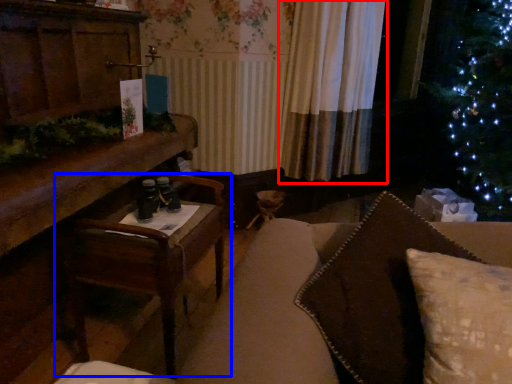
Question: Among these objects, which one is farthest to the camera, curtain (highlighted by a red box) or table (highlighted by a blue box)?

Choices:
 (A) curtain
 (B) table

Answer: (A)